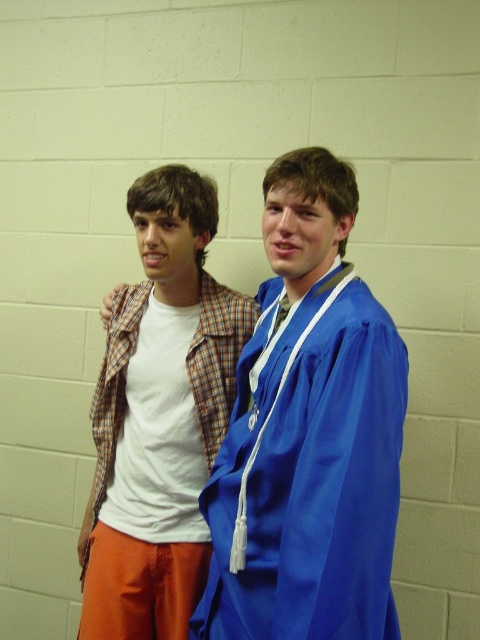
You are standing in front of the scene and want to place a small sticker on the point that is closer to you. Which point should you choose between the point at coordinates point [243,410] and point [105,616]?

You should choose point [243,410] because it is closer to the viewer than point [105,616].

Consider the image. You are a photographer setting up for a group photo. You have to position the satin blue graduation gown at center and the white cotton shirt at left so that both are fully visible in the frame. Considering their heights, which one should you adjust to ensure both are visible?

The satin blue graduation gown at center is not as tall as the white cotton shirt at left, so you should lower the camera angle slightly to ensure the taller white cotton shirt at left is fully visible while still capturing the shorter satin blue graduation gown at center in the frame.